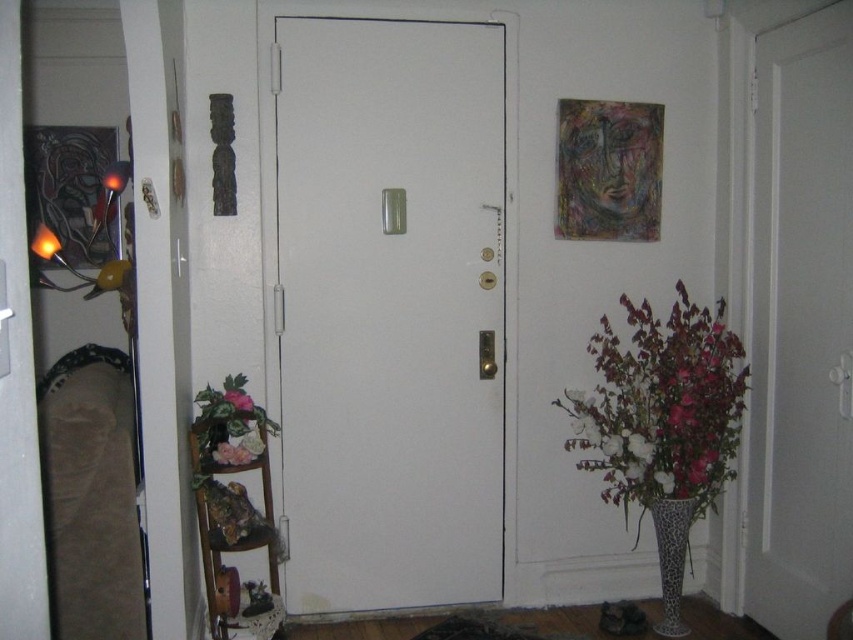
Is floral bouquet at right bigger than white matte vase at lower right?

Yes.

Is floral bouquet at right taller than white matte vase at lower right?

Yes, floral bouquet at right is taller than white matte vase at lower right.

Who is more forward, (x=637, y=326) or (x=670, y=477)?

Point (x=670, y=477)

Where is `floral bouquet at right`? The height and width of the screenshot is (640, 853). floral bouquet at right is located at coordinates (663, 422).

Can you confirm if floral bouquet at right is shorter than leopard print vase at lower right?

No.

Locate an element on the screen. This screenshot has width=853, height=640. floral bouquet at right is located at coordinates (x=663, y=422).

Can you confirm if pink matte flower at center is positioned to the left of white matte vase at lower right?

Correct, you'll find pink matte flower at center to the left of white matte vase at lower right.

Is pink matte flower at center below white matte vase at lower right?

No.

Between point (241, 401) and point (657, 472), which one is positioned in front?

Point (241, 401) is more forward.

At what (x,y) coordinates should I click in order to perform the action: click on pink matte flower at center. Please return your answer as a coordinate pair (x, y). Looking at the image, I should click on (238, 400).